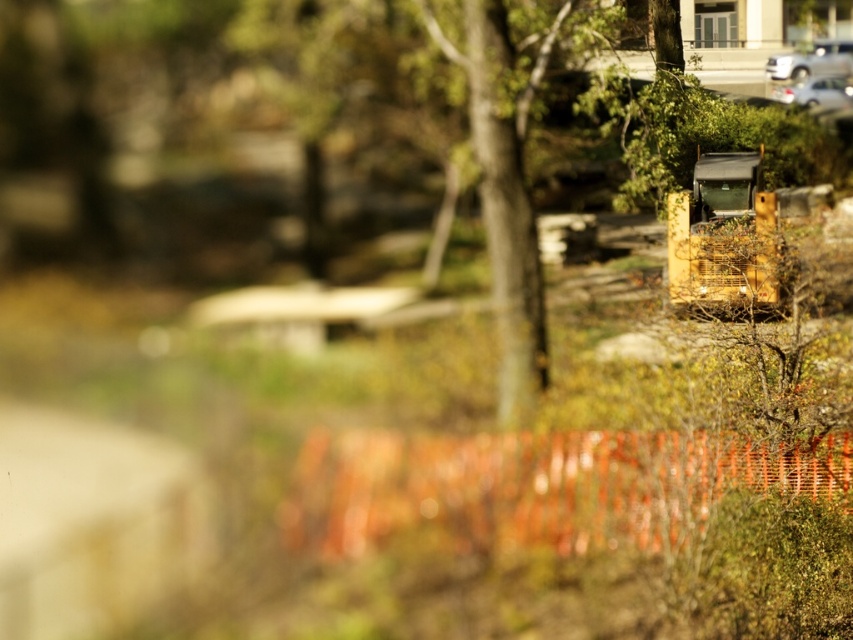
You are standing at the orange safety fence in the foreground of the construction site scene. You notice a point marked at coordinates (505, 189). What object does this point correspond to?

The point at coordinates (505, 189) corresponds to the green leafy tree at center.

You are a surveyor at the construction site. You need to determine the order of two points marked on the site map. The first point is point (490,35) and the second is point (838,104). Based on the image, which point is closer to you?

Point (490,35) is in front of point (838,104), so it is closer to you.

You are a surveyor trying to locate a specific point in a construction site. The point is marked as point (505, 189). According to the image, what is the closest object to this point?

The point (505, 189) indicates green leafy tree at center, so the closest object to this point is the green leafy tree at center.